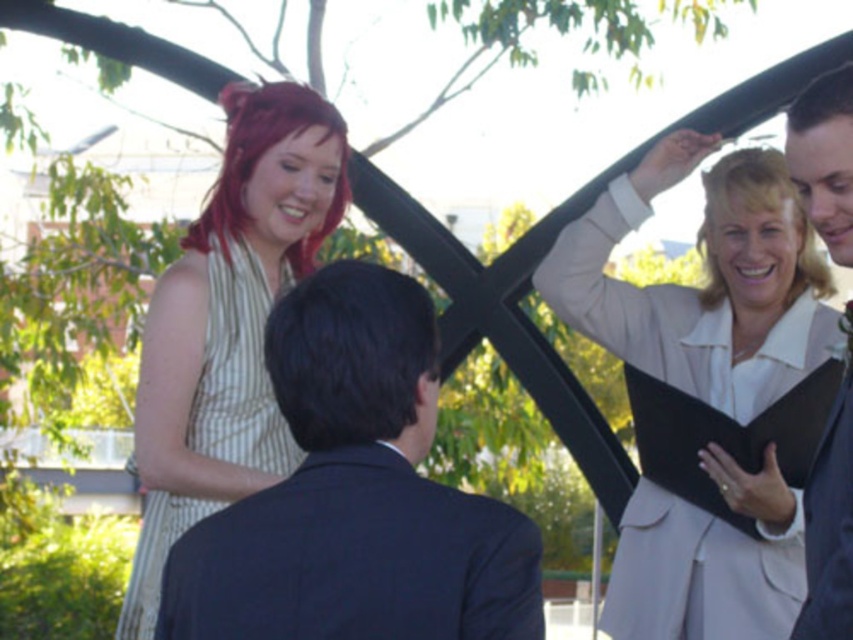
From the picture: Does dark blue suit at center have a lesser width compared to striped fabric dress at upper left?

Correct, dark blue suit at center's width is less than striped fabric dress at upper left's.

Consider the image. Is the position of dark blue suit at center more distant than that of striped fabric dress at upper left?

No, dark blue suit at center is closer to the viewer.

Is point (340, 605) farther from viewer compared to point (180, 528)?

No, (340, 605) is in front of (180, 528).

I want to click on dark blue suit at center, so click(355, 493).

Measure the distance between striped fabric dress at upper left and dark suit jacket at upper right.

striped fabric dress at upper left is 21.64 meters away from dark suit jacket at upper right.

The width and height of the screenshot is (853, 640). What do you see at coordinates (236, 369) in the screenshot?
I see `striped fabric dress at upper left` at bounding box center [236, 369].

Does point (213, 394) come in front of point (825, 84)?

No, it is behind (825, 84).

Image resolution: width=853 pixels, height=640 pixels. Identify the location of striped fabric dress at upper left. (236, 369).

Is dark blue suit at center below black matte clipboard at upper right?

Yes, dark blue suit at center is below black matte clipboard at upper right.

Based on the photo, who is higher up, dark blue suit at center or black matte clipboard at upper right?

black matte clipboard at upper right is higher up.

Is point (381, 458) positioned behind point (691, 492)?

No.

Locate an element on the screen. This screenshot has width=853, height=640. dark blue suit at center is located at coordinates (355, 493).